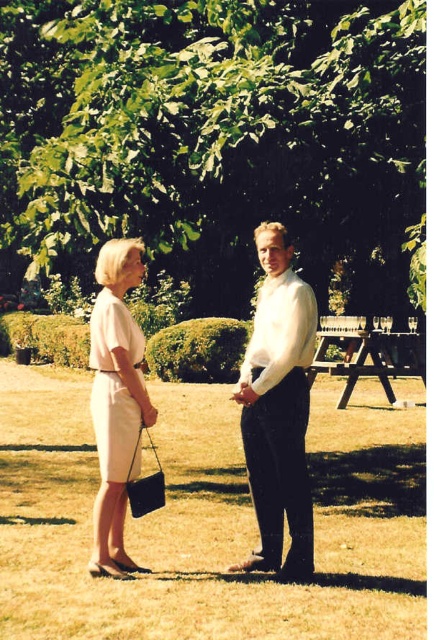
Does green leafy tree at upper center appear under white smooth shirt at center?

Result: Actually, green leafy tree at upper center is above white smooth shirt at center.

Which is behind, point (43, 160) or point (268, 429)?

The point (43, 160) is behind.

Locate an element on the screen. The image size is (434, 640). green leafy tree at upper center is located at coordinates (217, 140).

Does green grass at center have a lesser width compared to light beige fabric dress at center?

No, green grass at center is not thinner than light beige fabric dress at center.

Can you confirm if green grass at center is taller than light beige fabric dress at center?

In fact, green grass at center may be shorter than light beige fabric dress at center.

What do you see at coordinates (210, 520) in the screenshot?
I see `green grass at center` at bounding box center [210, 520].

At what (x,y) coordinates should I click in order to perform the action: click on green grass at center. Please return your answer as a coordinate pair (x, y). This screenshot has width=434, height=640. Looking at the image, I should click on (210, 520).

Is point (295, 353) more distant than point (119, 385)?

No, it is in front of (119, 385).

Locate an element on the screen. light beige fabric dress at center is located at coordinates (279, 408).